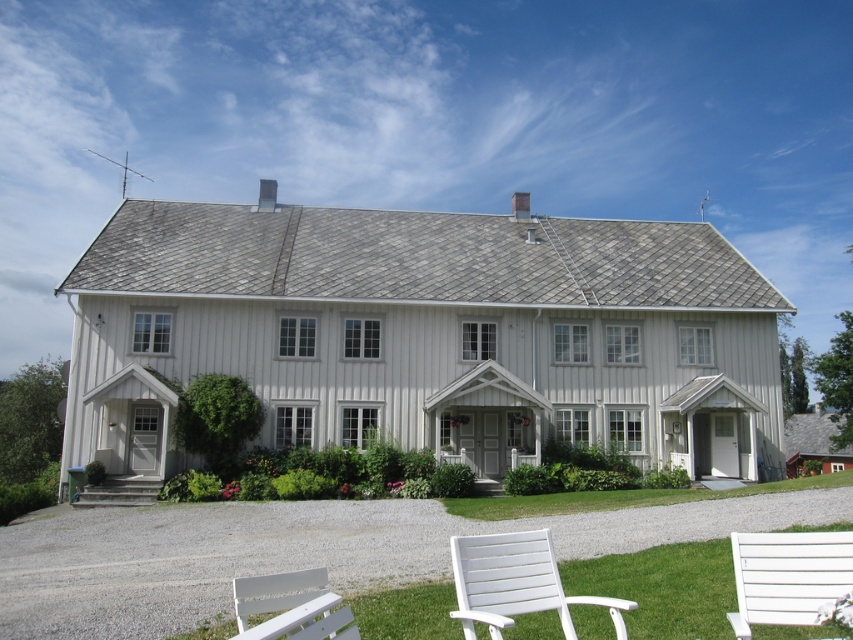
Is point (350, 616) farther from camera compared to point (134, 500)?

No, it is not.

Can you confirm if white painted wood bench at lower left is positioned to the left of gray concrete steps at lower left?

No, white painted wood bench at lower left is not to the left of gray concrete steps at lower left.

Which is in front, point (335, 602) or point (141, 497)?

Point (335, 602)

Find the location of a particular element. The height and width of the screenshot is (640, 853). white painted wood bench at lower left is located at coordinates (289, 605).

Who is positioned more to the right, white wood chairs at lower center or white wooden bench at lower right?

white wood chairs at lower center is more to the right.

Between white wood chairs at lower center and white wooden bench at lower right, which one is positioned higher?

white wooden bench at lower right is above.

Which is behind, point (724, 593) or point (790, 536)?

Point (724, 593)

The image size is (853, 640). I want to click on white wood chairs at lower center, so click(x=664, y=588).

Image resolution: width=853 pixels, height=640 pixels. What do you see at coordinates (664, 588) in the screenshot? I see `white wood chairs at lower center` at bounding box center [664, 588].

Does white wood chairs at lower center appear over white painted wood bench at lower left?

Actually, white wood chairs at lower center is below white painted wood bench at lower left.

What do you see at coordinates (664, 588) in the screenshot? The height and width of the screenshot is (640, 853). I see `white wood chairs at lower center` at bounding box center [664, 588].

Where is `white wood chairs at lower center`? Image resolution: width=853 pixels, height=640 pixels. white wood chairs at lower center is located at coordinates (664, 588).